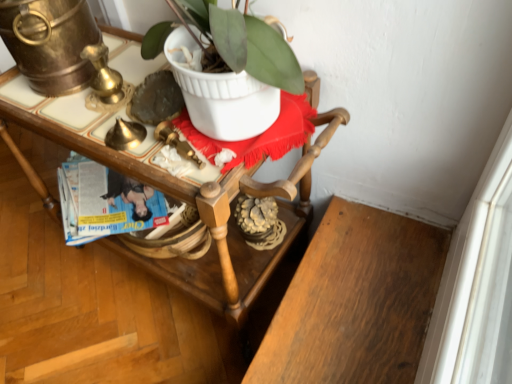
Question: Is wooden desk at center smaller than blue glossy magazine at center?

Choices:
 (A) no
 (B) yes

Answer: (A)

Question: From a real-world perspective, does wooden desk at center stand above blue glossy magazine at center?

Choices:
 (A) no
 (B) yes

Answer: (B)

Question: Does wooden desk at center have a lesser height compared to blue glossy magazine at center?

Choices:
 (A) no
 (B) yes

Answer: (A)

Question: Can you confirm if wooden desk at center is thinner than blue glossy magazine at center?

Choices:
 (A) no
 (B) yes

Answer: (A)

Question: From the image's perspective, is wooden desk at center located beneath blue glossy magazine at center?

Choices:
 (A) no
 (B) yes

Answer: (B)

Question: Is wooden desk at center oriented towards blue glossy magazine at center?

Choices:
 (A) no
 (B) yes

Answer: (B)

Question: From the image's perspective, would you say blue glossy magazine at center is shown under wooden desk at center?

Choices:
 (A) yes
 (B) no

Answer: (B)

Question: Can you confirm if blue glossy magazine at center is smaller than wooden desk at center?

Choices:
 (A) yes
 (B) no

Answer: (A)

Question: Considering the relative sizes of blue glossy magazine at center and wooden desk at center in the image provided, is blue glossy magazine at center thinner than wooden desk at center?

Choices:
 (A) no
 (B) yes

Answer: (B)

Question: Is blue glossy magazine at center positioned with its back to wooden desk at center?

Choices:
 (A) no
 (B) yes

Answer: (B)

Question: Does blue glossy magazine at center have a greater height compared to wooden desk at center?

Choices:
 (A) yes
 (B) no

Answer: (B)

Question: From a real-world perspective, is blue glossy magazine at center located higher than wooden desk at center?

Choices:
 (A) yes
 (B) no

Answer: (B)

Question: Considering the positions of blue glossy magazine at center and wooden desk at center in the image, is blue glossy magazine at center taller or shorter than wooden desk at center?

Choices:
 (A) tall
 (B) short

Answer: (B)